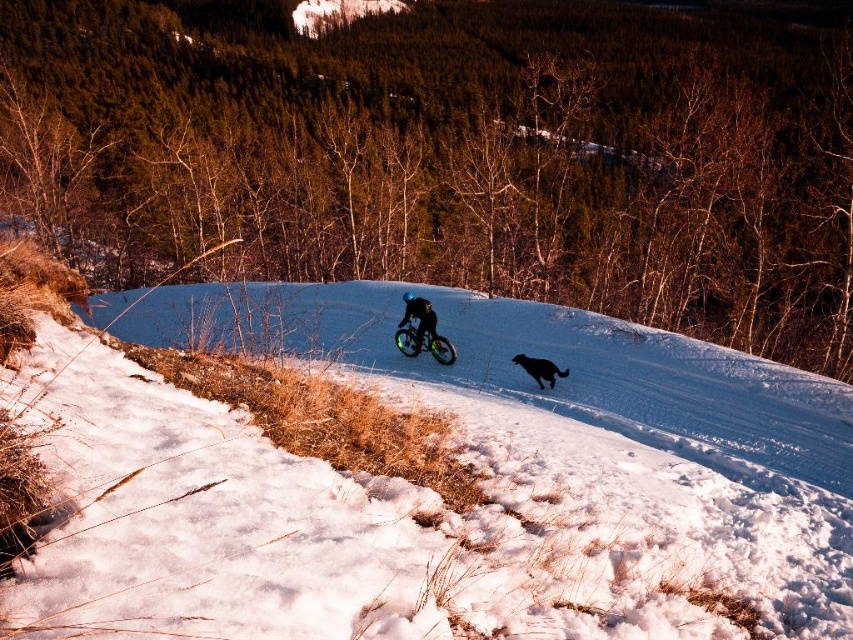
Question: Is green rubber mountain bike at center to the right of shiny black jacket at center from the viewer's perspective?

Choices:
 (A) yes
 (B) no

Answer: (B)

Question: Which of these objects is positioned closest to the black fur dog at center?

Choices:
 (A) shiny black jacket at center
 (B) green rubber mountain bike at center

Answer: (B)

Question: Can you confirm if green rubber mountain bike at center is positioned to the right of shiny black jacket at center?

Choices:
 (A) yes
 (B) no

Answer: (B)

Question: Which of the following is the farthest from the observer?

Choices:
 (A) tap(428, 330)
 (B) tap(428, 346)
 (C) tap(549, 384)

Answer: (B)

Question: Which object is the farthest from the black fur dog at center?

Choices:
 (A) green rubber mountain bike at center
 (B) shiny black jacket at center

Answer: (B)

Question: Does shiny black jacket at center appear under black fur dog at center?

Choices:
 (A) no
 (B) yes

Answer: (A)